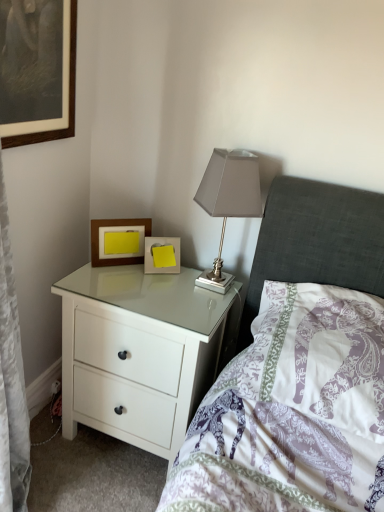
Question: Can you confirm if white glossy chest of drawers at center is thinner than yellow paper at center, the 3th picture frame positioned from the top?

Choices:
 (A) no
 (B) yes

Answer: (A)

Question: Is white glossy chest of drawers at center positioned far away from yellow paper at center, the 3th picture frame positioned from the top?

Choices:
 (A) yes
 (B) no

Answer: (B)

Question: Is white glossy chest of drawers at center wider than yellow paper at center, which is the 1th picture frame in right-to-left order?

Choices:
 (A) yes
 (B) no

Answer: (A)

Question: Is white glossy chest of drawers at center further to camera compared to yellow paper at center, the 1th picture frame in the bottom-to-top sequence?

Choices:
 (A) no
 (B) yes

Answer: (A)

Question: Does white glossy chest of drawers at center have a greater height compared to yellow paper at center, which is the 1th picture frame in right-to-left order?

Choices:
 (A) no
 (B) yes

Answer: (B)

Question: Does point (147, 221) appear closer or farther from the camera than point (264, 290)?

Choices:
 (A) farther
 (B) closer

Answer: (A)

Question: Is wooden picture frame at upper left, the second picture frame in the top-to-bottom sequence, situated inside purple printed pillow at center or outside?

Choices:
 (A) inside
 (B) outside

Answer: (B)

Question: Considering the relative positions of wooden picture frame at upper left, which is the second picture frame from bottom to top, and purple printed pillow at center in the image provided, is wooden picture frame at upper left, which is the second picture frame from bottom to top, to the left or to the right of purple printed pillow at center?

Choices:
 (A) left
 (B) right

Answer: (A)

Question: Based on their sizes in the image, would you say wooden picture frame at upper left, which appears as the second picture frame when viewed from the right, is bigger or smaller than purple printed pillow at center?

Choices:
 (A) big
 (B) small

Answer: (B)

Question: In the image, is purple printed pillow at center positioned in front of or behind white glossy chest of drawers at center?

Choices:
 (A) front
 (B) behind

Answer: (A)

Question: Would you say purple printed pillow at center is inside or outside white glossy chest of drawers at center?

Choices:
 (A) inside
 (B) outside

Answer: (B)

Question: In terms of height, does purple printed pillow at center look taller or shorter compared to white glossy chest of drawers at center?

Choices:
 (A) short
 (B) tall

Answer: (A)

Question: Considering the positions of purple printed pillow at center and white glossy chest of drawers at center in the image, is purple printed pillow at center wider or thinner than white glossy chest of drawers at center?

Choices:
 (A) wide
 (B) thin

Answer: (B)

Question: Is purple printed pillow at center bigger or smaller than wooden framed picture at upper left, positioned as the third picture frame in bottom-to-top order?

Choices:
 (A) small
 (B) big

Answer: (B)

Question: Is purple printed pillow at center in front of or behind wooden framed picture at upper left, the first picture frame in the top-to-bottom sequence, in the image?

Choices:
 (A) front
 (B) behind

Answer: (A)